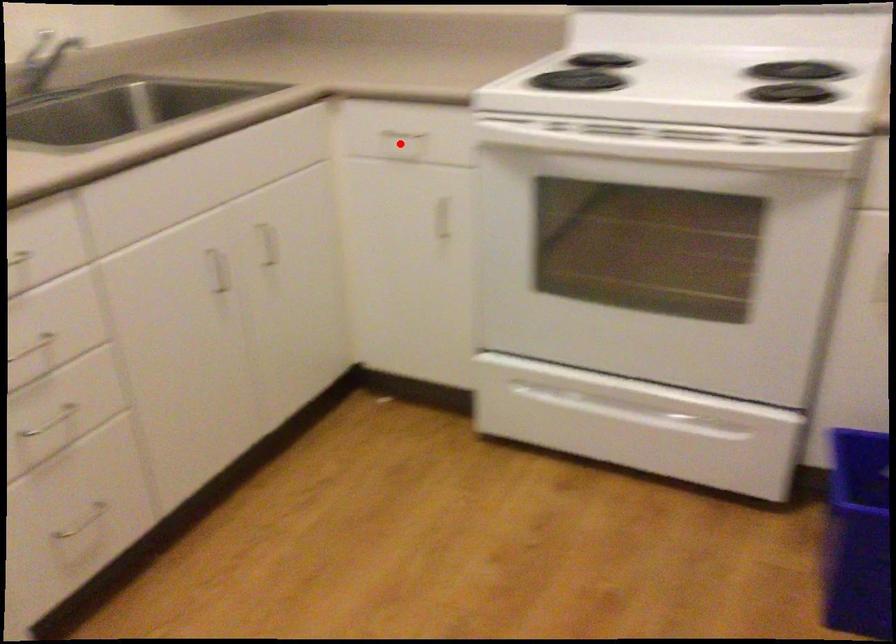
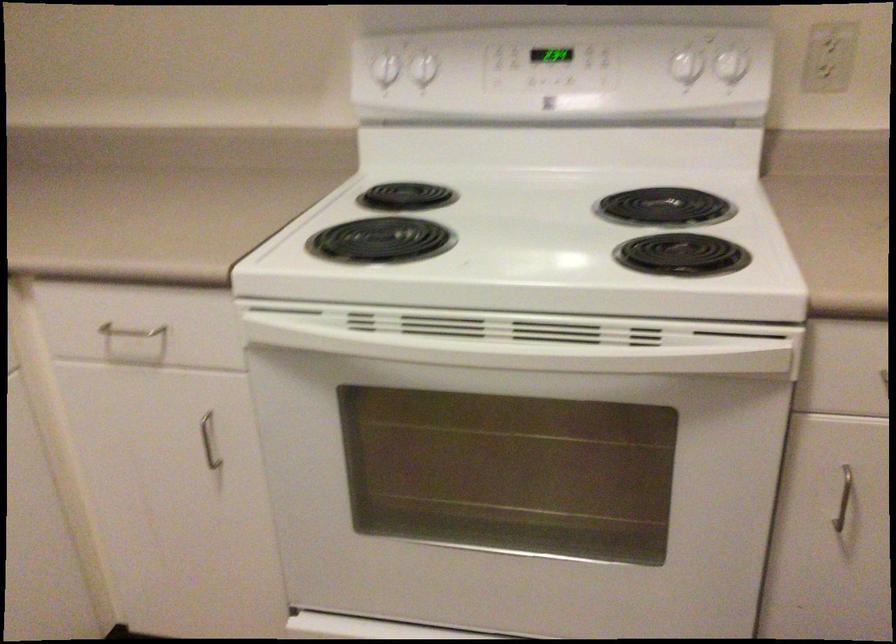
Question: A red point is marked in image1. In image2, is the corresponding 3D point closer to the camera or farther? Reply with the corresponding letter.

Choices:
 (A) The corresponding 3D point is closer.
 (B) The corresponding 3D point is farther.

Answer: (A)